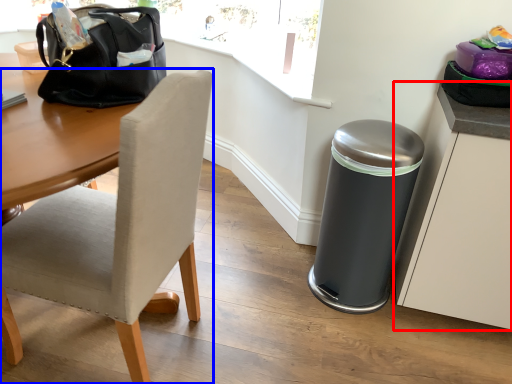
Question: Among these objects, which one is nearest to the camera, cabinetry (highlighted by a red box) or chair (highlighted by a blue box)?

Choices:
 (A) cabinetry
 (B) chair

Answer: (B)